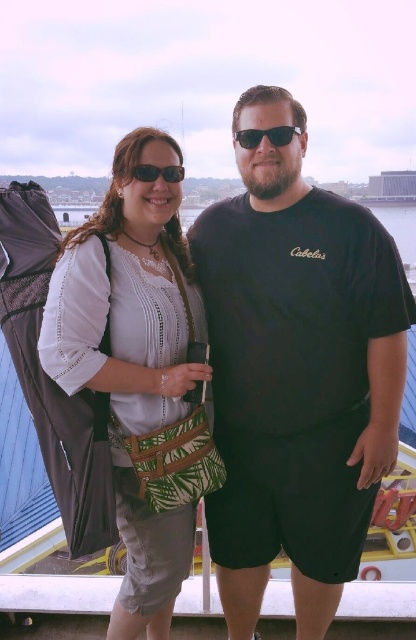
You are a photographer trying to capture a candid shot of the two people in the scene. You want to ensure that both the green leafy fabric bag at left and the sunglasses at center are visible in the frame. Given their distance apart, will you need to zoom in or zoom out to include both in the shot?

The green leafy fabric bag at left and sunglasses at center are 60.66 feet apart. To include both in the frame, you would need to zoom out to widen the field of view, as zooming in narrows it.